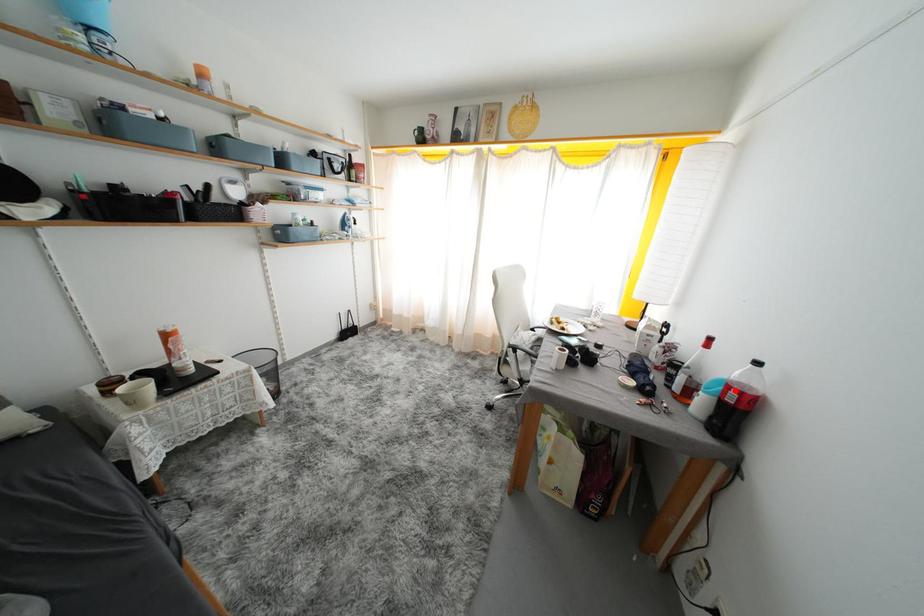
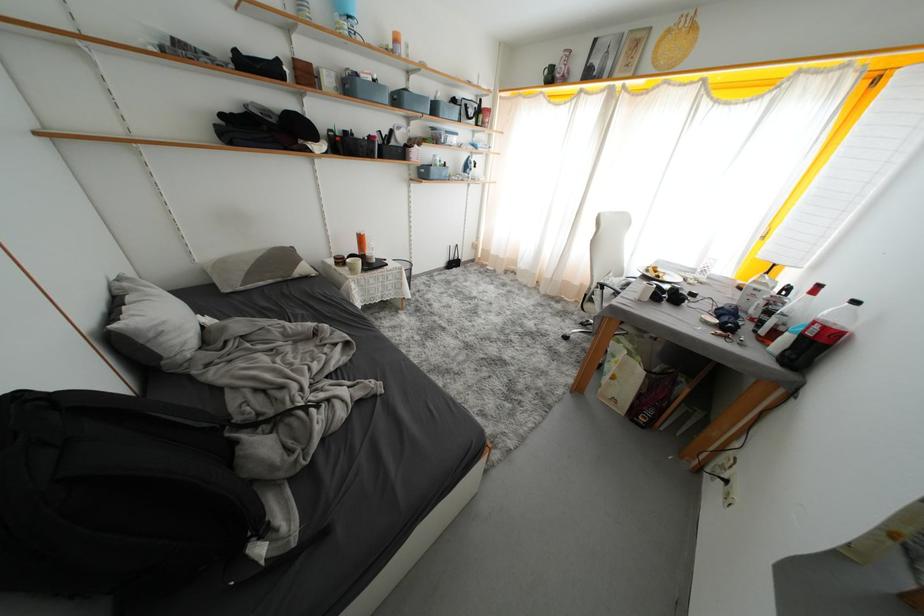
Question: I am providing you with two images of the same scene from different viewpoints. A red point is marked on the first image. At the location where the point appears in image 1, is it still visible in image 2?

Choices:
 (A) Yes
 (B) No

Answer: (A)